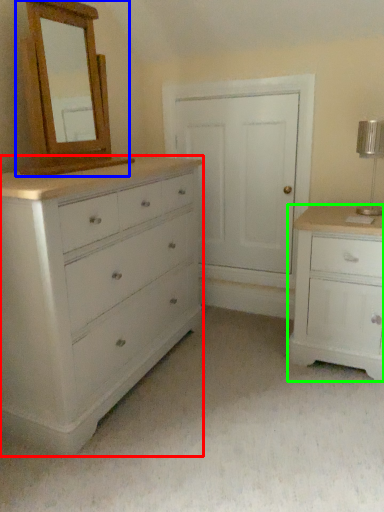
Question: Considering the real-world distances, which object is closest to chest of drawers (highlighted by a red box)? medicine cabinet (highlighted by a blue box) or chest of drawers (highlighted by a green box).

Choices:
 (A) medicine cabinet
 (B) chest of drawers

Answer: (A)